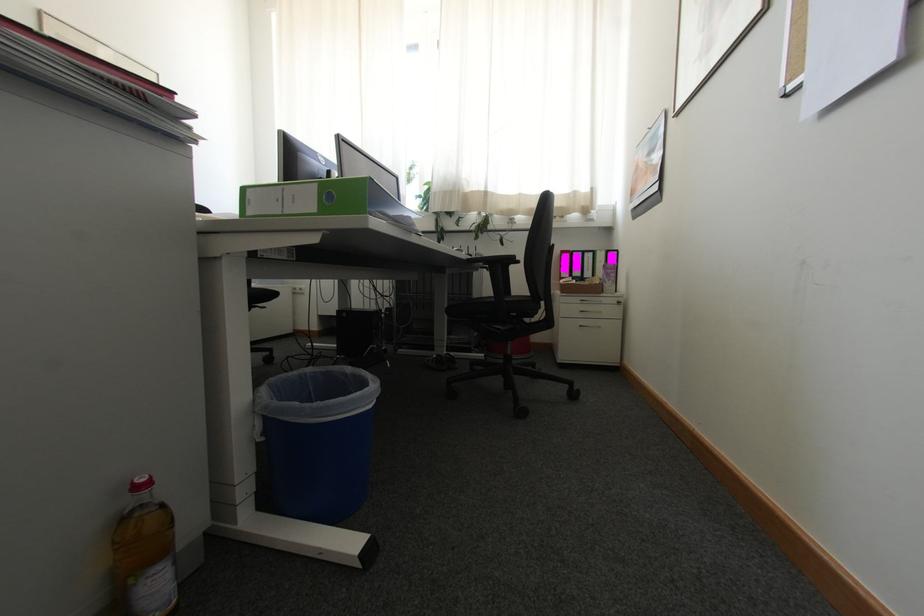
Which object does [305,198] point to?

It refers to a cardboard organizer box.